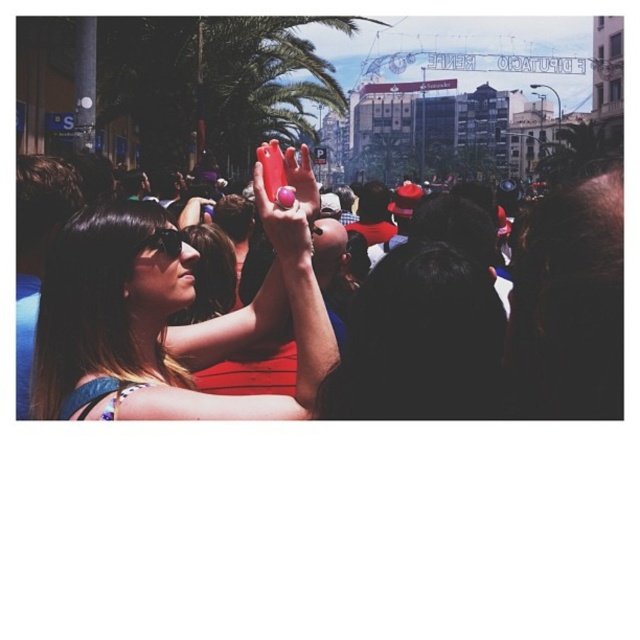
You are a photographer trying to capture a clear shot of both the matte red phone at center and the matte black goggles at center. Since both are at the center, which object should you focus on first to ensure clarity?

The matte red phone at center is closer to the viewer than the matte black goggles at center, so focusing on the matte red phone at center first will ensure both are in focus as the goggles are further away.

You are standing in the urban scene and want to move from the point at coordinates point (195,358) to the point at coordinates point (170,252). Which direction should you face to move towards the second point?

You should face away from the viewer because point (195,358) is further to the viewer than point (170,252), so moving towards the second point requires moving away from the viewer.

You are a photographer trying to capture a clear shot of the matte red phone at center during this event. Considering the distance, would you need a telephoto lens to focus on it from where you are standing?

The matte red phone at center is 100.24 meters away from the camera, so yes, you would need a telephoto lens to focus on it clearly from that distance.